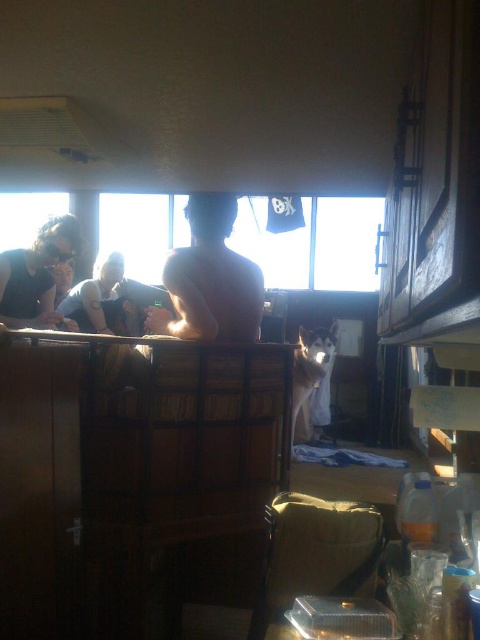
Question: Is transparent glass window at upper center positioned before matte black shirt at left?

Choices:
 (A) yes
 (B) no

Answer: (B)

Question: Which object is positioned closest to the matte black shirt at left?

Choices:
 (A) transparent glass window at upper center
 (B) naked skin at center

Answer: (B)

Question: Is transparent glass window at upper center thinner than naked skin at center?

Choices:
 (A) no
 (B) yes

Answer: (A)

Question: Which point appears closest to the camera in this image?

Choices:
 (A) (247, 294)
 (B) (4, 244)

Answer: (A)

Question: Which object is farther from the camera taking this photo?

Choices:
 (A) matte black shirt at left
 (B) transparent glass window at upper center
 (C) naked skin at center

Answer: (B)

Question: Does transparent glass window at upper center appear on the left side of naked skin at center?

Choices:
 (A) no
 (B) yes

Answer: (A)